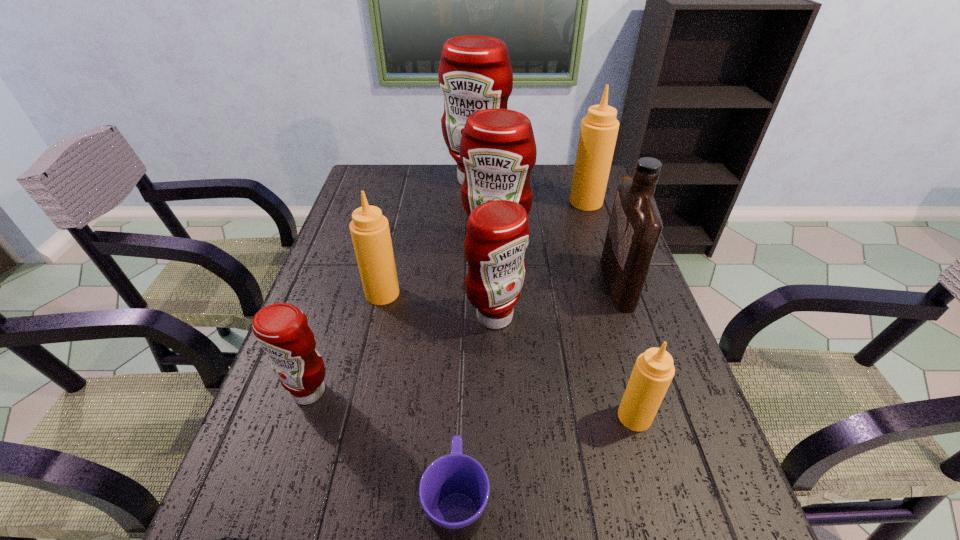
Locate which tan condiment is the closest to the leftmost red condiment. Please provide its 2D coordinates. Your answer should be formatted as a tuple, i.e. [(x, y)], where the tuple contains the x and y coordinates of a point satisfying the conditions above.

[(369, 229)]

The image size is (960, 540). Find the location of `blank space that satisfies the following two spatial constraints: 1. on the back side of the second condiment from left to right; 2. on the right side of the third farthest condiment`. blank space that satisfies the following two spatial constraints: 1. on the back side of the second condiment from left to right; 2. on the right side of the third farthest condiment is located at coordinates (395, 243).